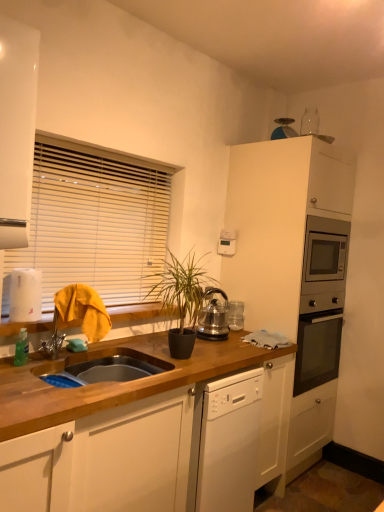
Question: Is polished stainless steel kettle at center aimed at white glossy cabinet at upper left, arranged as the first cabinetry when viewed from the left?

Choices:
 (A) no
 (B) yes

Answer: (A)

Question: Does polished stainless steel kettle at center have a larger size compared to white glossy cabinet at upper left, acting as the second cabinetry starting from the back?

Choices:
 (A) yes
 (B) no

Answer: (B)

Question: Does polished stainless steel kettle at center have a greater height compared to white glossy cabinet at upper left, marked as the first cabinetry in a front-to-back arrangement?

Choices:
 (A) yes
 (B) no

Answer: (B)

Question: From a real-world perspective, is polished stainless steel kettle at center positioned over white glossy cabinet at upper left, marked as the first cabinetry in a front-to-back arrangement, based on gravity?

Choices:
 (A) no
 (B) yes

Answer: (A)

Question: Does polished stainless steel kettle at center appear on the right side of white glossy cabinet at upper left, marked as the first cabinetry in a front-to-back arrangement?

Choices:
 (A) no
 (B) yes

Answer: (B)

Question: Is white glossy cabinet at upper left, arranged as the first cabinetry when viewed from the left, located within polished stainless steel kettle at center?

Choices:
 (A) yes
 (B) no

Answer: (B)

Question: Can you confirm if white matte cabinet at upper right, which is the 2th cabinetry in left-to-right order, is thinner than polished stainless steel kettle at center?

Choices:
 (A) no
 (B) yes

Answer: (A)

Question: Is white matte cabinet at upper right, the 1th cabinetry viewed from the back, at the right side of polished stainless steel kettle at center?

Choices:
 (A) no
 (B) yes

Answer: (B)

Question: Is white matte cabinet at upper right, positioned as the 2th cabinetry in front-to-back order, to the left of polished stainless steel kettle at center from the viewer's perspective?

Choices:
 (A) no
 (B) yes

Answer: (A)

Question: Is white matte cabinet at upper right, which is the 2th cabinetry in left-to-right order, aimed at polished stainless steel kettle at center?

Choices:
 (A) no
 (B) yes

Answer: (A)

Question: From a real-world perspective, is white matte cabinet at upper right, the 1th cabinetry viewed from the back, on top of polished stainless steel kettle at center?

Choices:
 (A) no
 (B) yes

Answer: (B)

Question: From a real-world perspective, is white matte cabinet at upper right, marked as the first cabinetry in a right-to-left arrangement, located beneath polished stainless steel kettle at center?

Choices:
 (A) no
 (B) yes

Answer: (A)

Question: Does wooden at left appear on the right side of white glossy cabinet at upper left, placed as the second cabinetry when sorted from right to left?

Choices:
 (A) yes
 (B) no

Answer: (A)